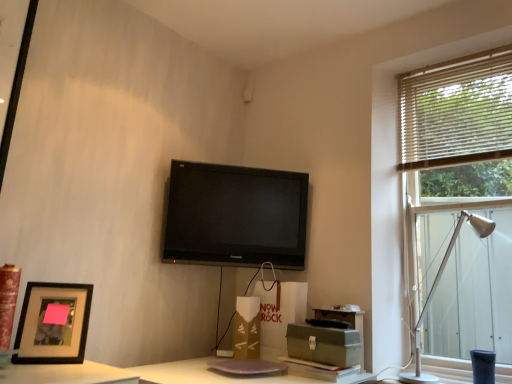
Question: Can you confirm if green cardboard box at lower center, arranged as the first cardboard box when viewed from the front, is thinner than black glossy tv at upper center?

Choices:
 (A) yes
 (B) no

Answer: (B)

Question: Considering the relative sizes of green cardboard box at lower center, the first cardboard box viewed from the right, and black glossy tv at upper center in the image provided, is green cardboard box at lower center, the first cardboard box viewed from the right, smaller than black glossy tv at upper center?

Choices:
 (A) yes
 (B) no

Answer: (A)

Question: Is green cardboard box at lower center, which ranks as the 2th cardboard box in back-to-front order, oriented towards black glossy tv at upper center?

Choices:
 (A) yes
 (B) no

Answer: (B)

Question: From the image's perspective, does green cardboard box at lower center, the first cardboard box viewed from the right, appear lower than black glossy tv at upper center?

Choices:
 (A) yes
 (B) no

Answer: (A)

Question: Is black glossy tv at upper center surrounded by green cardboard box at lower center, the first cardboard box viewed from the right?

Choices:
 (A) yes
 (B) no

Answer: (B)

Question: Can you confirm if green cardboard box at lower center, acting as the 2th cardboard box starting from the left, is positioned to the right of black glossy tv at upper center?

Choices:
 (A) no
 (B) yes

Answer: (B)

Question: Considering the relative positions of white wooden blinds at upper right and green cardboard box at lower center, the first cardboard box viewed from the right, in the image provided, is white wooden blinds at upper right to the right of green cardboard box at lower center, the first cardboard box viewed from the right, from the viewer's perspective?

Choices:
 (A) no
 (B) yes

Answer: (B)

Question: Does white wooden blinds at upper right lie in front of green cardboard box at lower center, which ranks as the 2th cardboard box in back-to-front order?

Choices:
 (A) yes
 (B) no

Answer: (B)

Question: Would you consider white wooden blinds at upper right to be distant from green cardboard box at lower center, arranged as the first cardboard box when viewed from the front?

Choices:
 (A) no
 (B) yes

Answer: (B)

Question: Is white wooden blinds at upper right at the left side of green cardboard box at lower center, which ranks as the 2th cardboard box in back-to-front order?

Choices:
 (A) yes
 (B) no

Answer: (B)

Question: From the image's perspective, is white wooden blinds at upper right located beneath green cardboard box at lower center, acting as the 2th cardboard box starting from the left?

Choices:
 (A) yes
 (B) no

Answer: (B)

Question: Does white wooden blinds at upper right have a lesser height compared to green cardboard box at lower center, which ranks as the 2th cardboard box in back-to-front order?

Choices:
 (A) no
 (B) yes

Answer: (A)

Question: Does matte white speaker at upper center have a greater height compared to silver metallic table lamp at right?

Choices:
 (A) no
 (B) yes

Answer: (A)